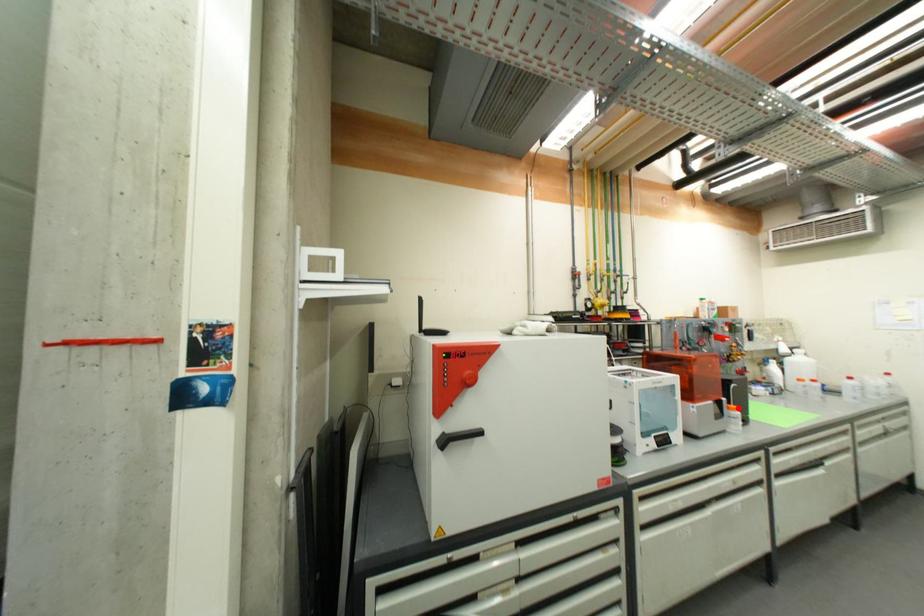
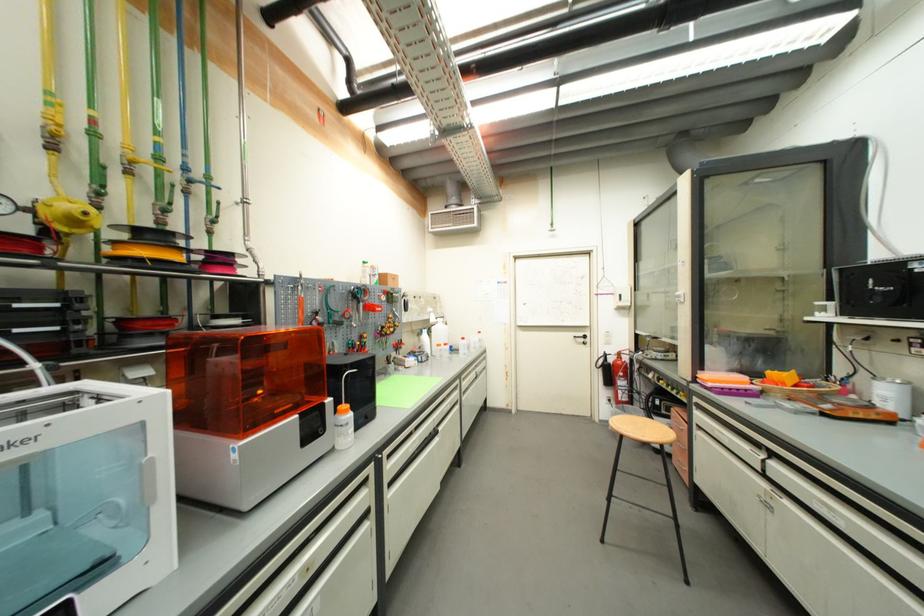
The point at the highlighted location is marked in the first image. Where is the corresponding point in the second image?

(349, 408)